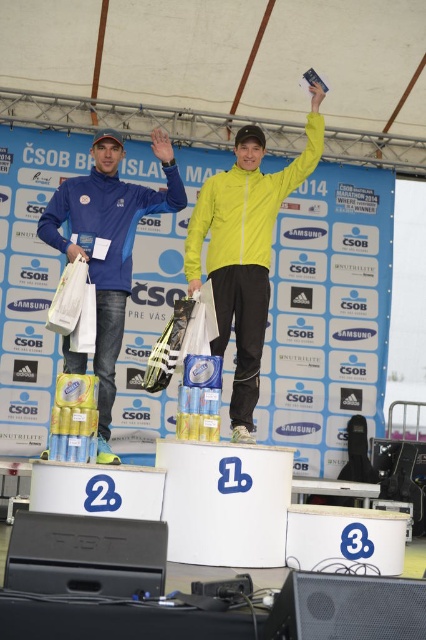
Question: Which point is farther to the camera?

Choices:
 (A) (75, 252)
 (B) (241, 275)

Answer: (B)

Question: Can you confirm if yellow matte jacket at center is wider than matte blue jacket at left?

Choices:
 (A) yes
 (B) no

Answer: (B)

Question: Which of the following is the closest to the observer?

Choices:
 (A) yellow matte jacket at center
 (B) matte blue jacket at left

Answer: (B)

Question: Can you confirm if yellow matte jacket at center is wider than matte blue jacket at left?

Choices:
 (A) no
 (B) yes

Answer: (A)

Question: Does yellow matte jacket at center have a greater width compared to matte blue jacket at left?

Choices:
 (A) yes
 (B) no

Answer: (B)